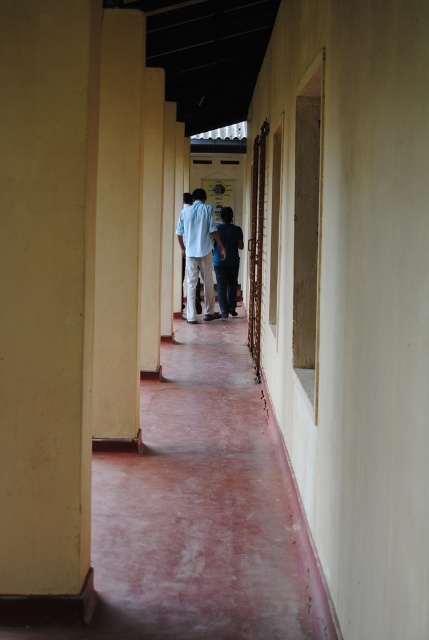
Question: Which object is farther from the camera taking this photo?

Choices:
 (A) yellow matte pillar at center
 (B) light blue shirt at center
 (C) dark blue shirt at center
 (D) light blue cotton shirt at center

Answer: (C)

Question: Can you confirm if light blue shirt at center is positioned to the left of light blue cotton shirt at center?

Choices:
 (A) no
 (B) yes

Answer: (A)

Question: From the image, what is the correct spatial relationship of yellow matte pillar at center in relation to dark blue shirt at center?

Choices:
 (A) right
 (B) left

Answer: (B)

Question: Among these objects, which one is farthest from the camera?

Choices:
 (A) yellow matte pillar at center
 (B) dark blue shirt at center

Answer: (B)

Question: Is yellow matte pillar at left below dark blue shirt at center?

Choices:
 (A) yes
 (B) no

Answer: (A)

Question: Which object appears closest to the camera in this image?

Choices:
 (A) dark blue shirt at center
 (B) yellow matte pillar at center
 (C) light blue cotton shirt at center
 (D) light blue shirt at center

Answer: (B)